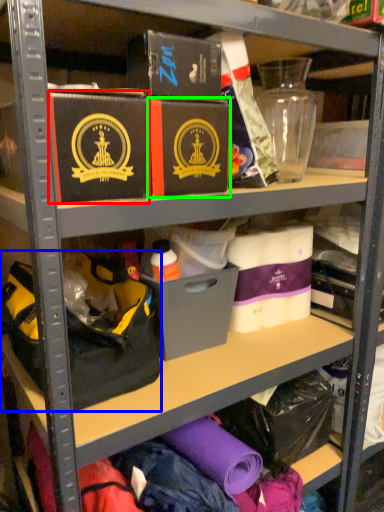
Question: Estimate the real-world distances between objects in this image. Which object is farther from box (highlighted by a red box), handbag (highlighted by a blue box) or box (highlighted by a green box)?

Choices:
 (A) handbag
 (B) box

Answer: (A)